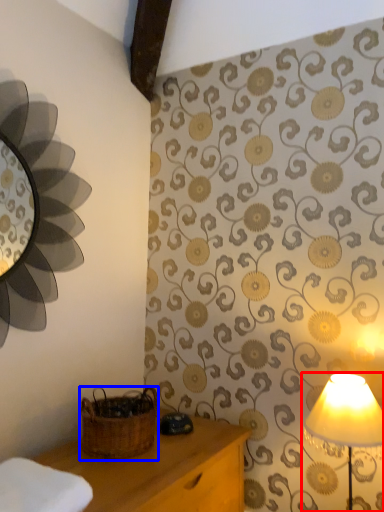
Question: Among these objects, which one is nearest to the camera, lamp (highlighted by a red box) or basket (highlighted by a blue box)?

Choices:
 (A) lamp
 (B) basket

Answer: (A)